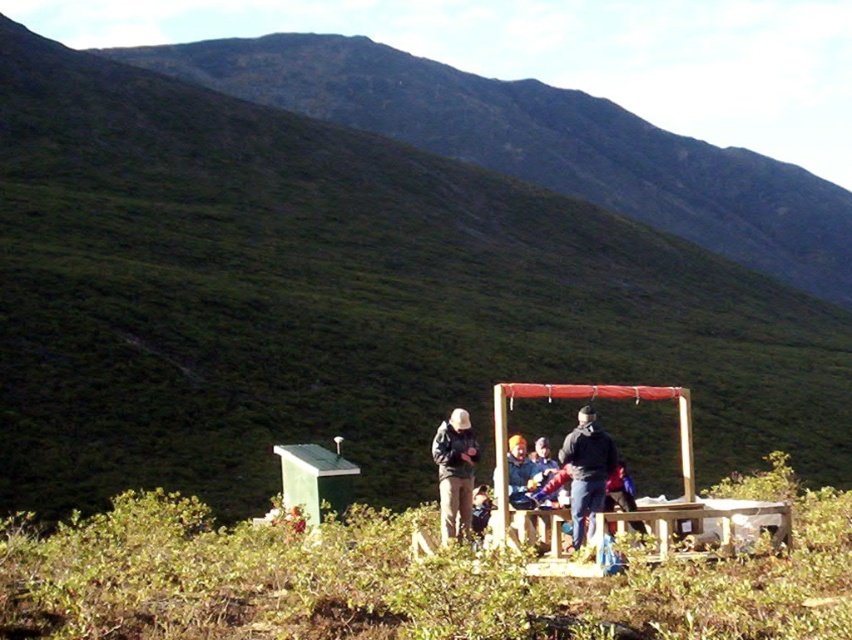
You are standing at point (x=314, y=477) in the image. What object is located at this point?

The green matte hut at lower left is located at point (x=314, y=477).

You are part of a hiking group and need to set up a tent. You have a dark brown jacket at center and a wooden picnic table at lower center. Where should you place the tent to be closest to both items?

The wooden picnic table at lower center is located below the dark brown jacket at center, so placing the tent between them would be closest to both items.